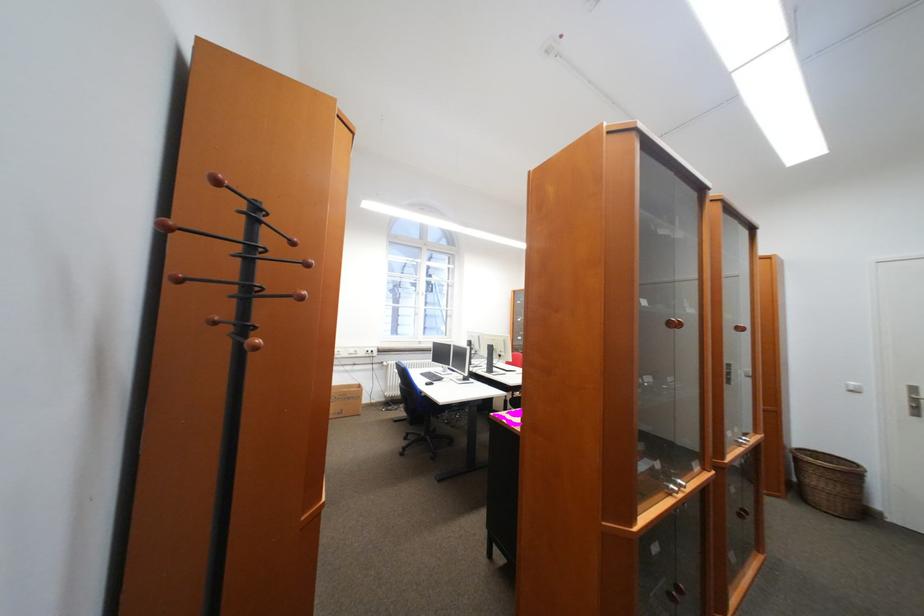
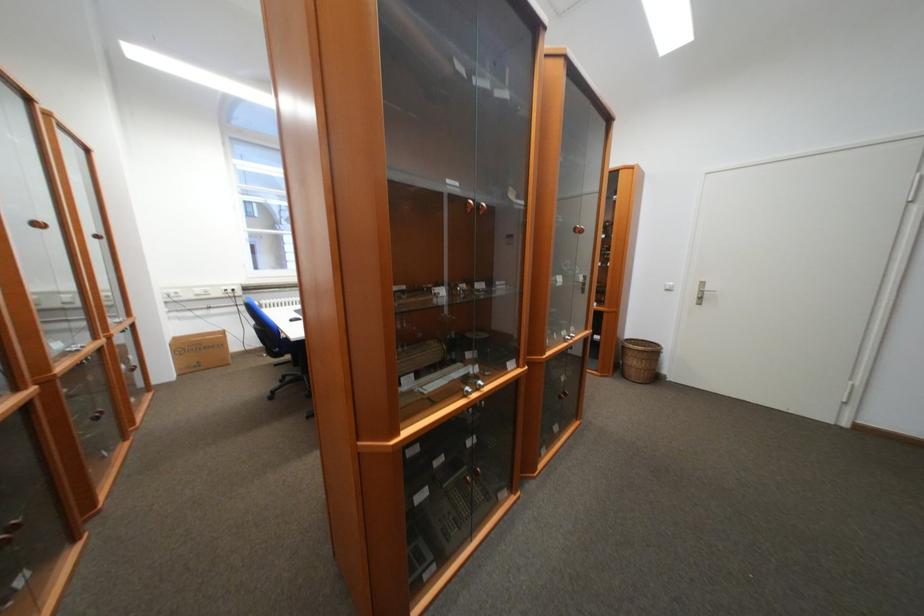
The point at [347,415] is marked in the first image. Where is the corresponding point in the second image?

(204, 368)